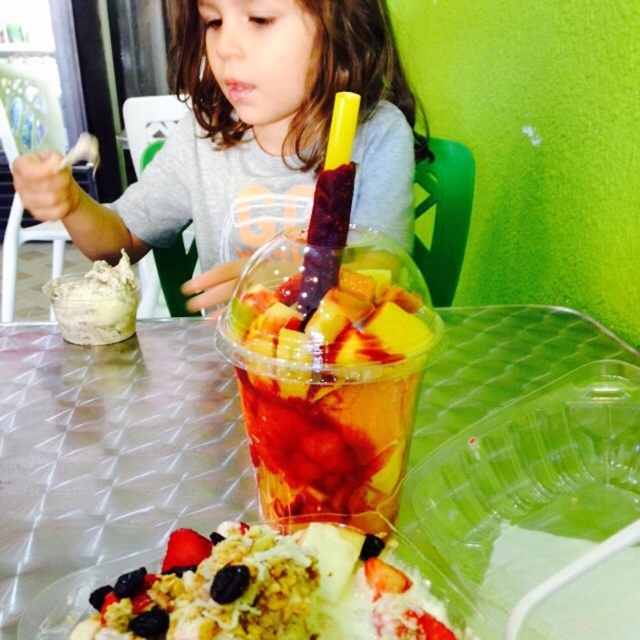
Question: Which object is closer to the camera taking this photo?

Choices:
 (A) matte gray shirt at upper left
 (B) slightly translucent plastic cup at center
 (C) translucent plastic cup at center

Answer: (C)

Question: Is translucent plastic cup at center in front of smooth strawberry at center?

Choices:
 (A) no
 (B) yes

Answer: (A)

Question: Which of the following is the closest to the observer?

Choices:
 (A) 269,294
 (B) 369,378
 (C) 83,204

Answer: (B)

Question: Among these objects, which one is farthest from the camera?

Choices:
 (A) translucent plastic cup at center
 (B) smooth strawberry at center
 (C) shiny granola topped with sliced fruits at center

Answer: (A)

Question: Does clear plastic table at center appear on the right side of matte gray shirt at upper left?

Choices:
 (A) no
 (B) yes

Answer: (B)

Question: In this image, where is translucent plastic cup at center located relative to slightly translucent plastic cup at center?

Choices:
 (A) right
 (B) left

Answer: (B)